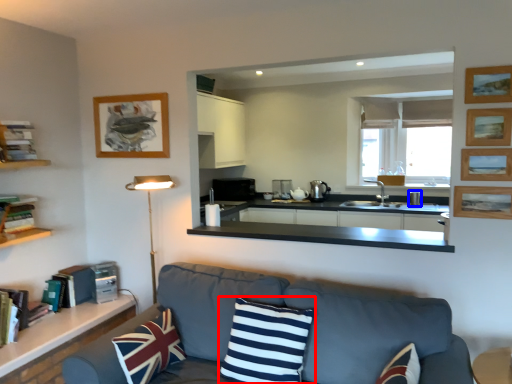
Question: Which point is further to the camera, pillow (highlighted by a red box) or appliance (highlighted by a blue box)?

Choices:
 (A) pillow
 (B) appliance

Answer: (B)